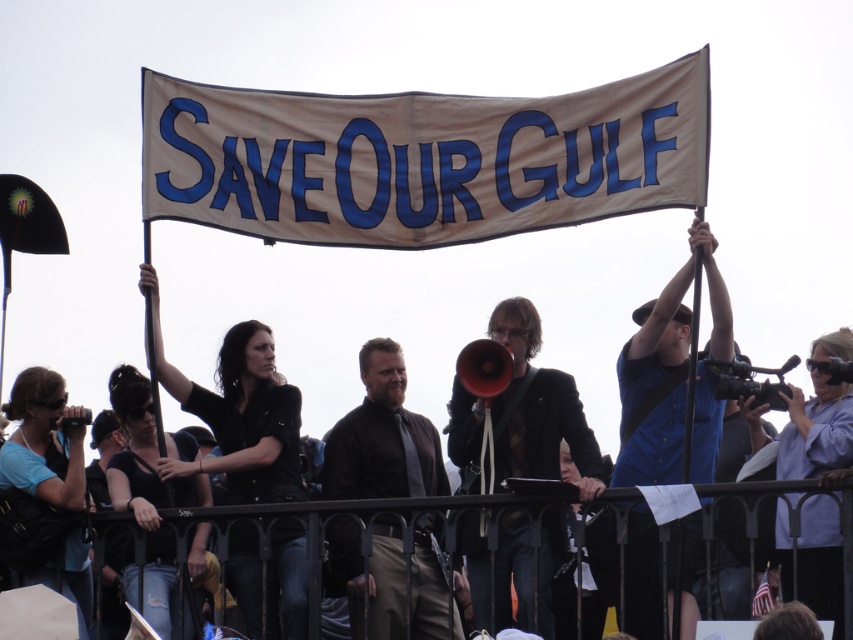
Question: Is brown leather jacket at center to the left of black metal fence at lower center from the viewer's perspective?

Choices:
 (A) yes
 (B) no

Answer: (A)

Question: Is black leather jacket at center bigger than black metal fence at lower center?

Choices:
 (A) no
 (B) yes

Answer: (A)

Question: Estimate the real-world distances between objects in this image. Which object is farther from the black metal fence at lower center?

Choices:
 (A) matte black jacket at center
 (B) blue fabric shirt at lower left

Answer: (B)

Question: Among these objects, which one is nearest to the camera?

Choices:
 (A) matte black jacket at center
 (B) blue shirt at upper right
 (C) blue cotton shirt at upper center

Answer: (B)

Question: Can you confirm if matte black jacket at center is wider than blue shirt at upper right?

Choices:
 (A) yes
 (B) no

Answer: (A)

Question: Which point is farther to the camera?

Choices:
 (A) black leather jacket at lower left
 (B) blue fabric shirt at lower left
 (C) black metal fence at lower center

Answer: (A)